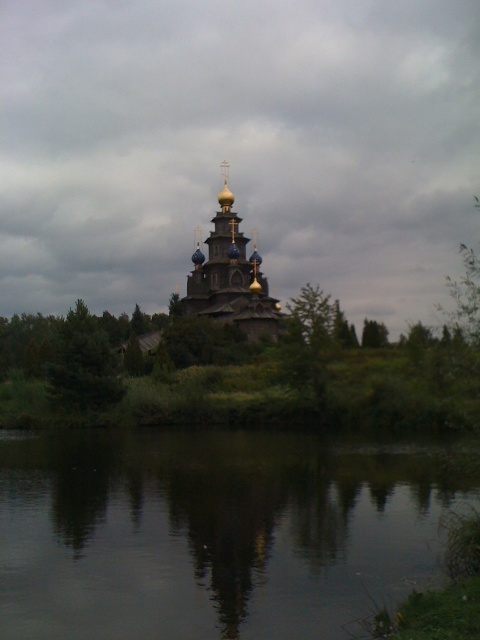
Question: Which of the following is the closest to the observer?

Choices:
 (A) gold domed church at center
 (B) greenish reflective water at lower center

Answer: (B)

Question: Which object is closer to the camera taking this photo?

Choices:
 (A) green matte tree at left
 (B) greenish reflective water at lower center
 (C) green leafy tree at center
 (D) gold domed church at center

Answer: (B)

Question: From the image, what is the correct spatial relationship of green matte tree at left in relation to green leafy tree at center?

Choices:
 (A) left
 (B) right

Answer: (A)

Question: From the image, what is the correct spatial relationship of gold domed church at center in relation to green leafy tree at center?

Choices:
 (A) right
 (B) left

Answer: (B)

Question: Is greenish reflective water at lower center closer to camera compared to gold domed church at center?

Choices:
 (A) yes
 (B) no

Answer: (A)

Question: Which object is closer to the camera taking this photo?

Choices:
 (A) gold domed church at center
 (B) greenish reflective water at lower center

Answer: (B)